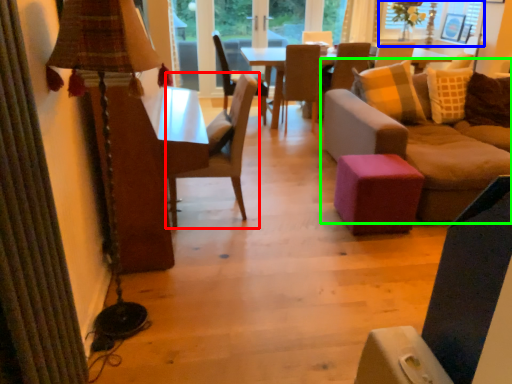
Question: Which is farther away from chair (highlighted by a red box)? window screen (highlighted by a blue box) or studio couch (highlighted by a green box)?

Choices:
 (A) window screen
 (B) studio couch

Answer: (A)